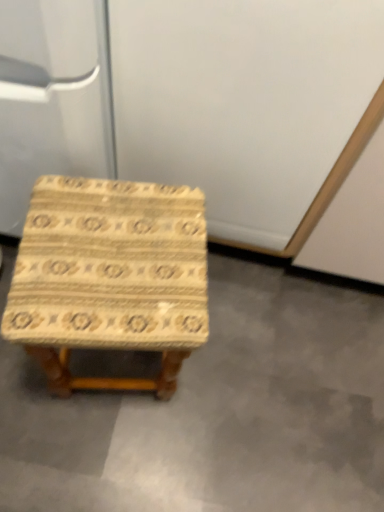
Question: In the image, is beige textured stool at center on the left side or the right side of wooden-patterned stool at center?

Choices:
 (A) right
 (B) left

Answer: (A)

Question: From the image's perspective, is beige textured stool at center positioned above or below wooden-patterned stool at center?

Choices:
 (A) above
 (B) below

Answer: (B)

Question: In terms of size, does beige textured stool at center appear bigger or smaller than wooden-patterned stool at center?

Choices:
 (A) big
 (B) small

Answer: (B)

Question: Is wooden-patterned stool at center inside the boundaries of beige textured stool at center, or outside?

Choices:
 (A) outside
 (B) inside

Answer: (A)

Question: Is wooden-patterned stool at center in front of or behind beige textured stool at center in the image?

Choices:
 (A) front
 (B) behind

Answer: (A)

Question: Is wooden-patterned stool at center to the left or to the right of beige textured stool at center in the image?

Choices:
 (A) left
 (B) right

Answer: (A)

Question: From a real-world perspective, is wooden-patterned stool at center above or below beige textured stool at center?

Choices:
 (A) below
 (B) above

Answer: (B)